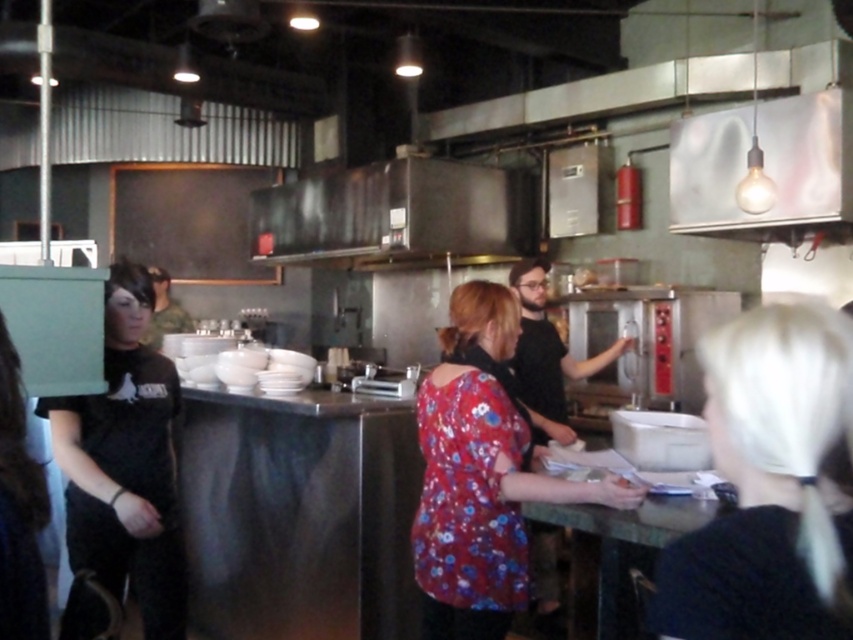
Question: Can you confirm if blonde hair at center is positioned to the right of black matte shirt at left?

Choices:
 (A) no
 (B) yes

Answer: (B)

Question: Which object appears farthest from the camera in this image?

Choices:
 (A) floral fabric blouse at center
 (B) matte black shirt at left
 (C) blonde hair at center

Answer: (A)

Question: Which object appears closest to the camera in this image?

Choices:
 (A) matte black shirt at left
 (B) blonde hair at center

Answer: (B)

Question: Is blonde hair at center to the left of matte black shirt at left from the viewer's perspective?

Choices:
 (A) no
 (B) yes

Answer: (A)

Question: Which object appears closest to the camera in this image?

Choices:
 (A) black matte shirt at left
 (B) blonde hair at center

Answer: (B)

Question: Can you confirm if blonde hair at center is positioned to the right of matte black shirt at left?

Choices:
 (A) no
 (B) yes

Answer: (B)